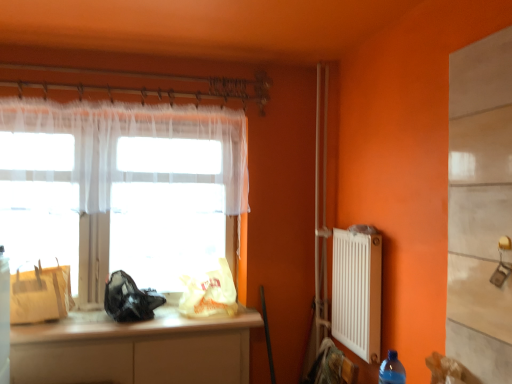
Locate an element on the screen. blue plastic bottle at lower right is located at coordinates (392, 370).

What is the approximate width of translucent fabric at left?

translucent fabric at left is 2.37 inches in width.

Measure the distance between point (39, 279) and camera.

Point (39, 279) is 2.22 meters away from camera.

What are the coordinates of `matte yellow paper bag at left, arranged as the first bag when viewed from the left` in the screenshot? It's located at (40, 294).

You are a GUI agent. You are given a task and a screenshot of the screen. Output one action in this format:
    pyautogui.click(x=<x>, y=<y>)
    Task: Click on the white plastic radiator at right
    This screenshot has height=384, width=512.
    Given the screenshot: What is the action you would take?
    pyautogui.click(x=357, y=293)

Where is `black matte bag at window, arranged as the 2th bag when viewed from the left`? Image resolution: width=512 pixels, height=384 pixels. black matte bag at window, arranged as the 2th bag when viewed from the left is located at coordinates (129, 299).

What do you see at coordinates (129, 299) in the screenshot? The width and height of the screenshot is (512, 384). I see `black matte bag at window, arranged as the 2th bag when viewed from the left` at bounding box center [129, 299].

Locate an element on the screen. The image size is (512, 384). white sheer curtain at upper left is located at coordinates (131, 136).

Where is `blue plastic bottle at lower right`? The height and width of the screenshot is (384, 512). blue plastic bottle at lower right is located at coordinates (392, 370).

Is translucent plastic bag at window, marked as the 1th bag in a right-to-left arrangement, positioned far away from translucent fabric at left?

translucent plastic bag at window, marked as the 1th bag in a right-to-left arrangement, is actually quite close to translucent fabric at left.

From the image's perspective, which is below, translucent plastic bag at window, marked as the 1th bag in a right-to-left arrangement, or translucent fabric at left?

From the image's view, translucent plastic bag at window, marked as the 1th bag in a right-to-left arrangement, is below.

Is translucent plastic bag at window, the 3th bag from the left, oriented towards translucent fabric at left?

No, translucent plastic bag at window, the 3th bag from the left, does not turn towards translucent fabric at left.

From a real-world perspective, which object rests below the other?

translucent plastic bag at window, marked as the 1th bag in a right-to-left arrangement, is physically lower.

Where is `counter top that appears below the white plastic radiator at right (from the image's perspective)`? The image size is (512, 384). counter top that appears below the white plastic radiator at right (from the image's perspective) is located at coordinates (128, 326).

Would you say white plastic radiator at right is outside wooden counter top at lower left?

Indeed, white plastic radiator at right is completely outside wooden counter top at lower left.

Based on the photo, does white plastic radiator at right have a greater width compared to wooden counter top at lower left?

No.

Considering the relative sizes of white plastic radiator at right and white sheer curtain at upper left in the image provided, is white plastic radiator at right wider than white sheer curtain at upper left?

No, white plastic radiator at right is not wider than white sheer curtain at upper left.

Does white plastic radiator at right come in front of white sheer curtain at upper left?

Yes, white plastic radiator at right is closer to the camera.

From the image's perspective, between white plastic radiator at right and white sheer curtain at upper left, which one is located above?

white sheer curtain at upper left is shown above in the image.

Based on the photo, which object is further away from the camera, blue plastic bottle at lower right or white sheer curtain at upper left?

Positioned behind is white sheer curtain at upper left.

Is blue plastic bottle at lower right facing towards white sheer curtain at upper left?

No, blue plastic bottle at lower right is not aimed at white sheer curtain at upper left.

Can you confirm if blue plastic bottle at lower right is smaller than white sheer curtain at upper left?

Correct, blue plastic bottle at lower right occupies less space than white sheer curtain at upper left.

Considering the sizes of objects blue plastic bottle at lower right and white sheer curtain at upper left in the image provided, who is wider, blue plastic bottle at lower right or white sheer curtain at upper left?

white sheer curtain at upper left is wider.

Could you tell me if blue plastic bottle at lower right is facing black matte bag at window, acting as the second bag starting from the right?

No, blue plastic bottle at lower right is not oriented towards black matte bag at window, acting as the second bag starting from the right.

Considering the relative positions of blue plastic bottle at lower right and black matte bag at window, acting as the second bag starting from the right, in the image provided, is blue plastic bottle at lower right in front of black matte bag at window, acting as the second bag starting from the right,?

Yes, it is in front of black matte bag at window, acting as the second bag starting from the right.

How many degrees apart are the facing directions of blue plastic bottle at lower right and black matte bag at window, arranged as the 2th bag when viewed from the left?

They differ by 98.5 degrees in their facing directions.

Is point (381, 366) more distant than point (132, 303)?

No.

Measure the distance from translucent fabric at left to translucent plastic bag at window, marked as the 1th bag in a right-to-left arrangement.

translucent fabric at left is 16.01 inches from translucent plastic bag at window, marked as the 1th bag in a right-to-left arrangement.

Is translucent fabric at left aimed at translucent plastic bag at window, marked as the 1th bag in a right-to-left arrangement?

Yes, translucent fabric at left faces towards translucent plastic bag at window, marked as the 1th bag in a right-to-left arrangement.

Is translucent fabric at left to the left of translucent plastic bag at window, the 3th bag from the left, from the viewer's perspective?

Yes.

Which of these two, translucent fabric at left or translucent plastic bag at window, the 3th bag from the left, stands shorter?

With less height is translucent plastic bag at window, the 3th bag from the left.

Which is in front, point (126, 304) or point (11, 329)?

The point (11, 329) is closer to the camera.

Are black matte bag at window, acting as the second bag starting from the right, and wooden counter top at lower left beside each other?

black matte bag at window, acting as the second bag starting from the right, and wooden counter top at lower left are clearly separated.

Could you tell me if black matte bag at window, arranged as the 2th bag when viewed from the left, is facing wooden counter top at lower left?

No.

In terms of width, does black matte bag at window, acting as the second bag starting from the right, look wider or thinner when compared to wooden counter top at lower left?

Clearly, black matte bag at window, acting as the second bag starting from the right, has less width compared to wooden counter top at lower left.

From the image's perspective, count 2nd bags downward from the translucent fabric at left and point to it. Please provide its 2D coordinates.

[(209, 293)]

Identify the location of radiator above the wooden counter top at lower left (from the image's perspective). (357, 293).

From the picture: From the image, which object appears to be nearer to wooden counter top at lower left, white sheer curtain at upper left or matte yellow paper bag at left, arranged as the first bag when viewed from the left?

Based on the image, matte yellow paper bag at left, arranged as the first bag when viewed from the left, appears to be nearer to wooden counter top at lower left.

From the image, which object appears to be farther from matte white cabinet at lower left, wooden counter top at lower left or blue plastic bottle at lower right?

blue plastic bottle at lower right is positioned further to the anchor matte white cabinet at lower left.

Estimate the real-world distances between objects in this image. Which object is closer to translucent fabric at left, black matte bag at window, arranged as the 2th bag when viewed from the left, or matte yellow paper bag at left, which appears as the 3th bag when viewed from the right?

black matte bag at window, arranged as the 2th bag when viewed from the left, is closer to translucent fabric at left.

From the image, which object appears to be farther from blue plastic bottle at lower right, white sheer curtain at upper left or matte white cabinet at lower left?

white sheer curtain at upper left is positioned further to the anchor blue plastic bottle at lower right.

From the image, which object appears to be nearer to translucent plastic bag at window, the 3th bag from the left, black matte bag at window, arranged as the 2th bag when viewed from the left, or white sheer curtain at upper left?

Among the two, black matte bag at window, arranged as the 2th bag when viewed from the left, is located nearer to translucent plastic bag at window, the 3th bag from the left.

Looking at the image, which one is located further to translucent fabric at left, matte yellow paper bag at left, arranged as the first bag when viewed from the left, or wooden counter top at lower left?

matte yellow paper bag at left, arranged as the first bag when viewed from the left, is positioned further to the anchor translucent fabric at left.

Estimate the real-world distances between objects in this image. Which object is further from matte yellow paper bag at left, arranged as the first bag when viewed from the left, wooden counter top at lower left or black matte bag at window, acting as the second bag starting from the right?

black matte bag at window, acting as the second bag starting from the right, is further to matte yellow paper bag at left, arranged as the first bag when viewed from the left.

When comparing their distances from blue plastic bottle at lower right, does black matte bag at window, arranged as the 2th bag when viewed from the left, or white plastic radiator at right seem closer?

Among the two, white plastic radiator at right is located nearer to blue plastic bottle at lower right.

The width and height of the screenshot is (512, 384). I want to click on bay window between white sheer curtain at upper left and matte white cabinet at lower left in the vertical direction, so click(170, 197).

I want to click on cabinetry situated between black matte bag at window, arranged as the 2th bag when viewed from the left, and blue plastic bottle at lower right from left to right, so click(x=134, y=349).

The width and height of the screenshot is (512, 384). I want to click on bag located between matte white cabinet at lower left and blue plastic bottle at lower right in the left-right direction, so click(x=209, y=293).

Identify the location of bay window between white sheer curtain at upper left and translucent plastic bag at window, the 3th bag from the left, in the vertical direction. This screenshot has width=512, height=384. (170, 197).